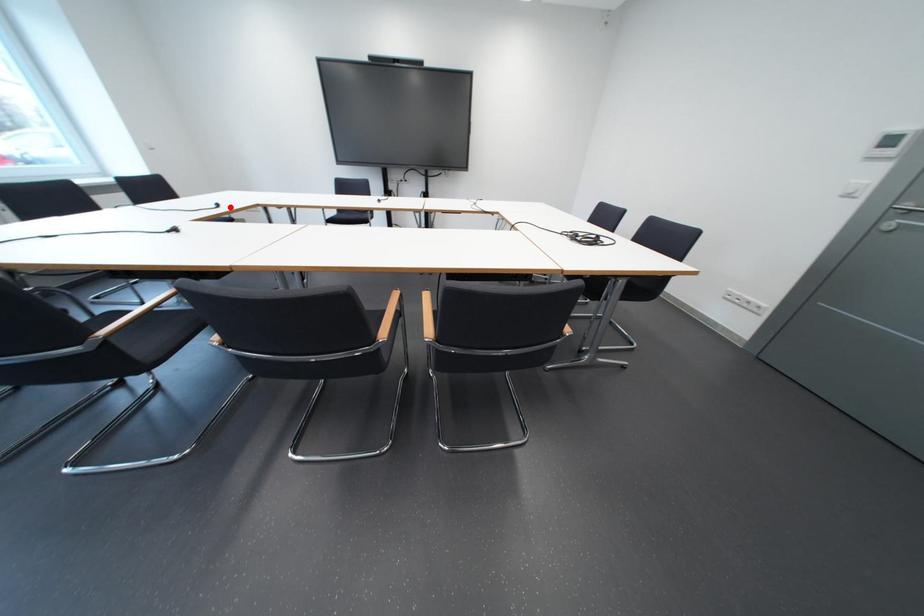
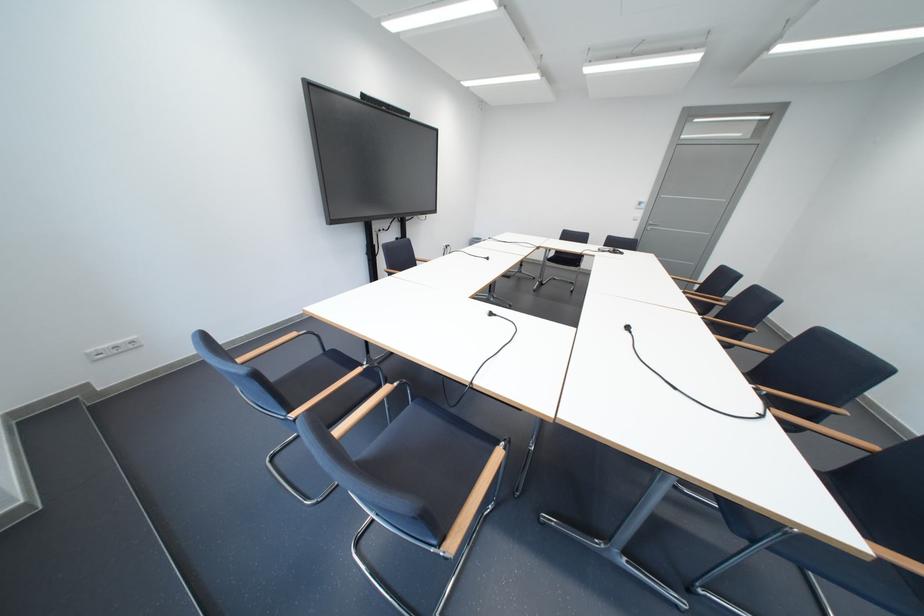
Find the pixel in the second image that matches the highlighted location in the first image.

(503, 315)